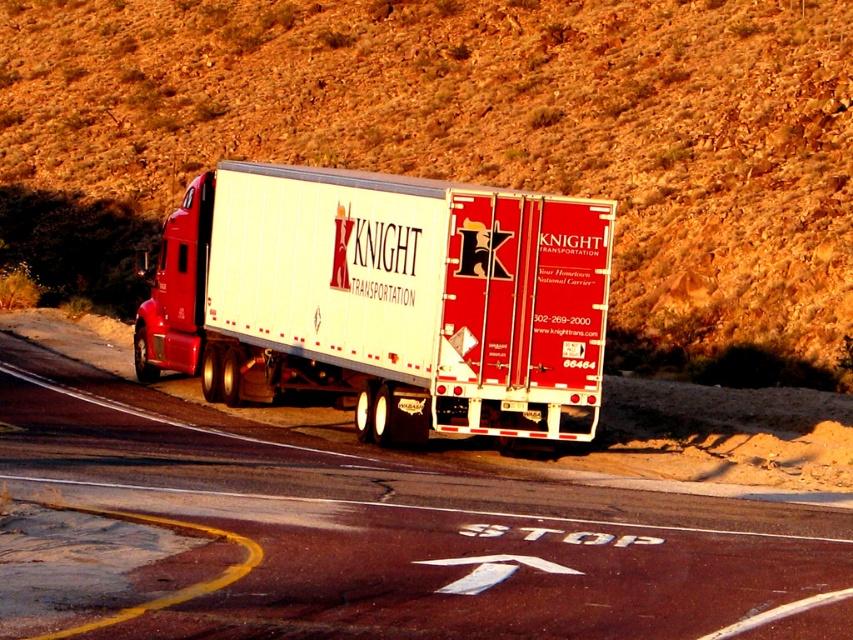
You are a driver approaching the Knight Transportation semi truck on the road. You need to know if the brown textured hillside at upper center is wider than the smooth asphalt road at center to plan your route. Can you determine this?

The brown textured hillside at upper center might be wider than smooth asphalt road at center according to the description provided.

You are a driver approaching the white glossy trailer truck at center. You notice a brown textured hillside at upper center in your view. From your perspective, is the hillside to the left or right of the truck?

The brown textured hillside at upper center is positioned on the right side of the white glossy trailer truck at center, so from your perspective, the hillside is to the right of the truck.

You are driving a car and need to park behind the white glossy trailer truck at center. The parking spot is on the smooth asphalt road at center. Can you fit your car there if your car is as wide as the trailer?

The smooth asphalt road at center might be wider than white glossy trailer truck at center, so there is a possibility that your car can fit if the road is indeed wider. However, since the exact width difference isn not specified, it depends on whether the road provides enough space beyond the trailer truck.